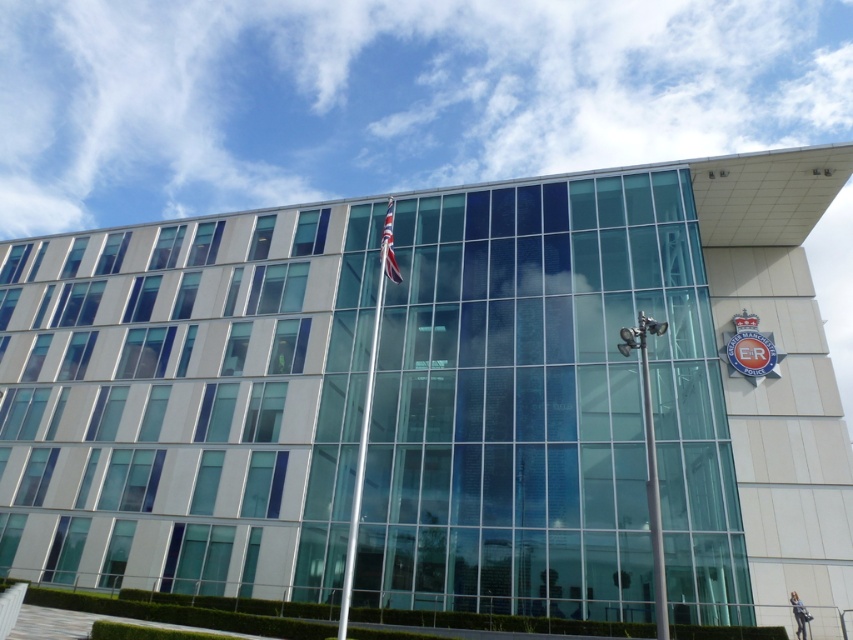
Looking at this image, can you confirm if silver metallic flag pole at center is smaller than red flag at upper center?

No, silver metallic flag pole at center is not smaller than red flag at upper center.

This screenshot has height=640, width=853. Identify the location of silver metallic flag pole at center. (367, 412).

Between point (351, 557) and point (387, 234), which one is positioned behind?

The point (387, 234) is more distant.

The height and width of the screenshot is (640, 853). I want to click on silver metallic flag pole at center, so click(x=367, y=412).